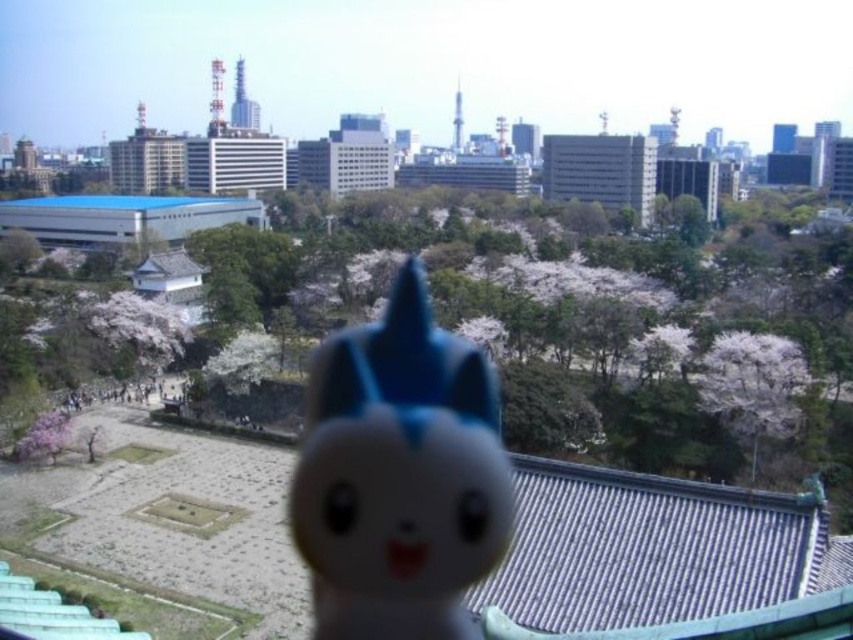
What do you see at coordinates (579, 314) in the screenshot?
I see `white blossoms at center` at bounding box center [579, 314].

Where is `white blossoms at center`? white blossoms at center is located at coordinates (579, 314).

Consider the image. Which is more to the right, white blossoms at center or blue matte plush toy at center?

From the viewer's perspective, white blossoms at center appears more on the right side.

Which is below, white blossoms at center or blue matte plush toy at center?

blue matte plush toy at center

Between point (531, 388) and point (329, 522), which one is positioned behind?

The point (531, 388) is more distant.

The image size is (853, 640). What are the coordinates of `white blossoms at center` in the screenshot? It's located at (579, 314).

Which is below, blue matte plush toy at center or pink blossoms at center?

Positioned lower is blue matte plush toy at center.

Is point (450, 563) less distant than point (780, 433)?

Yes, it is in front of point (780, 433).

You are a GUI agent. You are given a task and a screenshot of the screen. Output one action in this format:
    pyautogui.click(x=<x>, y=<y>)
    Task: Click on the blue matte plush toy at center
    
    Given the screenshot: What is the action you would take?
    pyautogui.click(x=399, y=476)